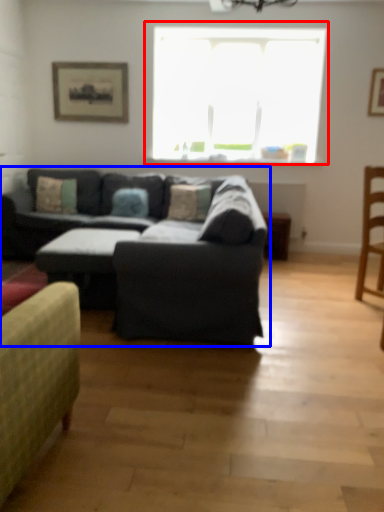
Question: Which object is further to the camera taking this photo, window (highlighted by a red box) or studio couch (highlighted by a blue box)?

Choices:
 (A) window
 (B) studio couch

Answer: (A)